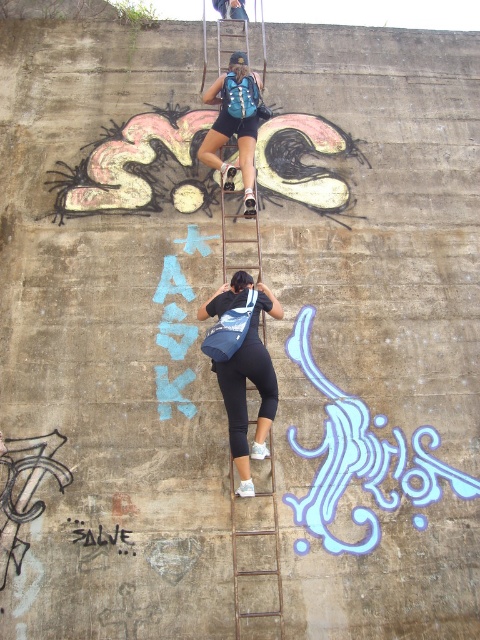
Is point (244, 493) closer to viewer compared to point (217, 129)?

Yes.

Between point (260, 424) and point (251, 104), which one is positioned in front?

Point (260, 424) is in front.

You are a GUI agent. You are given a task and a screenshot of the screen. Output one action in this format:
    pyautogui.click(x=<x>, y=<y>)
    Task: Click on the denim bag at center
    This screenshot has width=480, height=640.
    Given the screenshot: What is the action you would take?
    pyautogui.click(x=244, y=390)

Identify the location of denim bag at center. (244, 390).

Does point (275, 616) come behind point (264, 348)?

No, (275, 616) is in front of (264, 348).

Is rusty metal ladder at center thinner than denim bag at center?

No.

Who is more forward, (x=236, y=502) or (x=248, y=365)?

Positioned in front is point (x=248, y=365).

Locate an element on the screen. rusty metal ladder at center is located at coordinates (254, 557).

Which is below, rusty metal ladder at center or blue fabric backpack at center?

Positioned lower is rusty metal ladder at center.

Is rusty metal ladder at center to the right of blue fabric backpack at center from the viewer's perspective?

Yes, rusty metal ladder at center is to the right of blue fabric backpack at center.

Does point (238, 628) come behind point (229, 118)?

No, it is in front of (229, 118).

The width and height of the screenshot is (480, 640). Identify the location of rusty metal ladder at center. (254, 557).